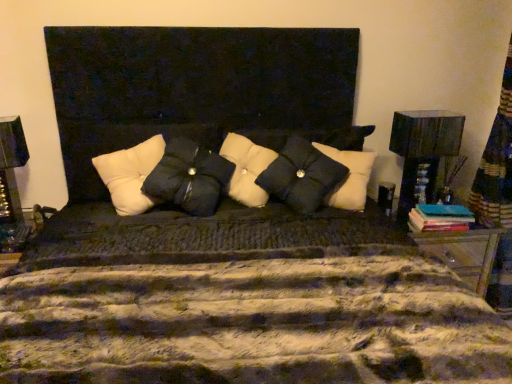
Question: In the image, is white tufted pillow at center, arranged as the 3th pillow when viewed from the right, positioned in front of or behind black textured pillow at center, marked as the 3th pillow in a left-to-right arrangement?

Choices:
 (A) front
 (B) behind

Answer: (A)

Question: Is white tufted pillow at center, arranged as the 3th pillow when viewed from the right, inside the boundaries of black textured pillow at center, the first pillow positioned from the right, or outside?

Choices:
 (A) inside
 (B) outside

Answer: (B)

Question: Which object is positioned farthest from the matte black lampshade at right?

Choices:
 (A) teal matte book at right
 (B) black matte pillow at center, which is the second pillow in right-to-left order
 (C) white tufted pillow at center, arranged as the 3th pillow when viewed from the right
 (D) black textured pillow at center, the first pillow positioned from the right

Answer: (C)

Question: Which of these objects is positioned closest to the teal matte book at right?

Choices:
 (A) white tufted pillow at center, arranged as the 3th pillow when viewed from the right
 (B) black matte pillow at center, placed as the second pillow when sorted from left to right
 (C) matte black lampshade at right
 (D) black textured pillow at center, marked as the 3th pillow in a left-to-right arrangement

Answer: (C)